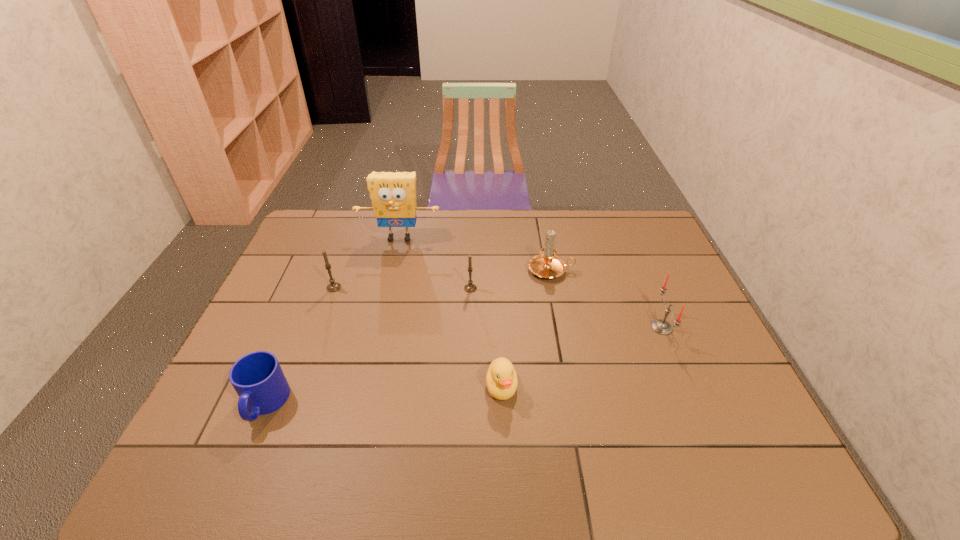
I want to click on object that is at the right edge, so click(661, 326).

Locate an element on the screen. free space at the far edge is located at coordinates (445, 226).

Where is `blank space at the left edge`? The image size is (960, 540). blank space at the left edge is located at coordinates (x=281, y=273).

Where is `vacant area at the right edge of the desktop`? This screenshot has height=540, width=960. vacant area at the right edge of the desktop is located at coordinates (695, 357).

Find the location of a particular element. free space at the far left corner is located at coordinates (340, 234).

What are the coordinates of `free region at the far right corner of the desktop` in the screenshot? It's located at (651, 217).

The image size is (960, 540). Identify the location of empty space that is in between the tallest object and the fourth object from left to right. (435, 263).

Identify the location of vacant region between the leftmost candle and the mug. pos(300,346).

Image resolution: width=960 pixels, height=540 pixels. Identify the location of free space between the second candle from left to right and the leftmost candle. (402, 288).

I want to click on vacant point located between the tallest object and the third candle from left to right, so click(x=475, y=254).